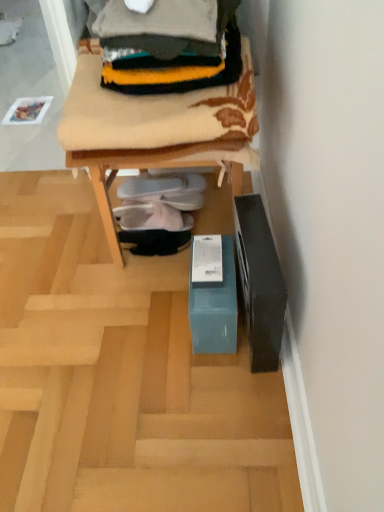
The height and width of the screenshot is (512, 384). Find the location of `vacant area that is in front of teal cardboard box at lower center`. vacant area that is in front of teal cardboard box at lower center is located at coordinates (128, 355).